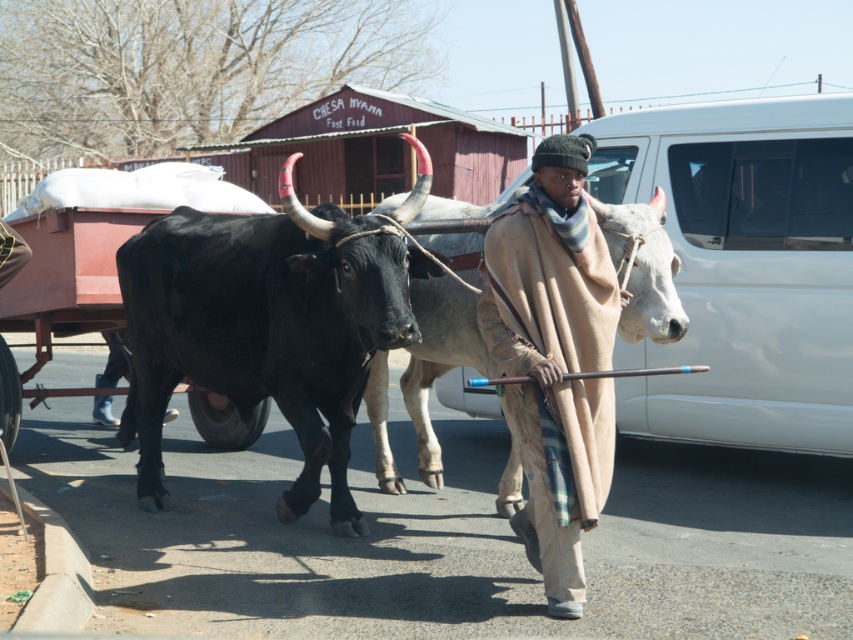
Is shiny black bull at center above beige woolen blanket at center?

Indeed, shiny black bull at center is positioned over beige woolen blanket at center.

Can you confirm if shiny black bull at center is positioned to the right of beige woolen blanket at center?

No, shiny black bull at center is not to the right of beige woolen blanket at center.

The image size is (853, 640). Find the location of `shiny black bull at center`. shiny black bull at center is located at coordinates (265, 328).